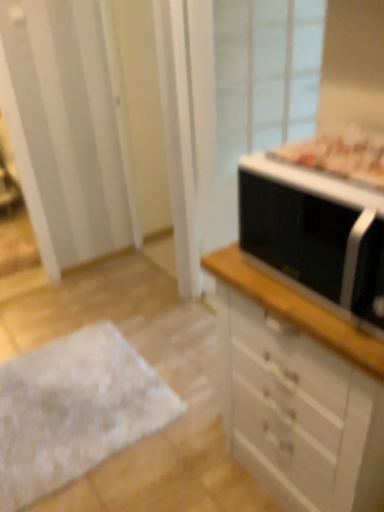
Question: Is white fluffy rug at lower left looking in the opposite direction of transparent glass screen door at upper right?

Choices:
 (A) yes
 (B) no

Answer: (B)

Question: From the image's perspective, would you say white fluffy rug at lower left is shown under transparent glass screen door at upper right?

Choices:
 (A) no
 (B) yes

Answer: (B)

Question: From a real-world perspective, is white fluffy rug at lower left beneath transparent glass screen door at upper right?

Choices:
 (A) no
 (B) yes

Answer: (B)

Question: Is white fluffy rug at lower left closer to the viewer compared to transparent glass screen door at upper right?

Choices:
 (A) no
 (B) yes

Answer: (B)

Question: Can you confirm if white fluffy rug at lower left is positioned to the left of transparent glass screen door at upper right?

Choices:
 (A) yes
 (B) no

Answer: (A)

Question: From the image's perspective, is black matte microwave at right located above or below transparent glass screen door at upper right?

Choices:
 (A) above
 (B) below

Answer: (B)

Question: Considering the positions of black matte microwave at right and transparent glass screen door at upper right in the image, is black matte microwave at right bigger or smaller than transparent glass screen door at upper right?

Choices:
 (A) small
 (B) big

Answer: (A)

Question: In the image, is black matte microwave at right positioned in front of or behind transparent glass screen door at upper right?

Choices:
 (A) front
 (B) behind

Answer: (A)

Question: Do you think black matte microwave at right is within transparent glass screen door at upper right, or outside of it?

Choices:
 (A) outside
 (B) inside

Answer: (A)

Question: Considering their positions, is white fluffy rug at lower left located in front of or behind transparent glass screen door at upper right?

Choices:
 (A) behind
 (B) front

Answer: (B)

Question: Does point (19, 459) appear closer or farther from the camera than point (216, 7)?

Choices:
 (A) farther
 (B) closer

Answer: (B)

Question: In terms of height, does white fluffy rug at lower left look taller or shorter compared to transparent glass screen door at upper right?

Choices:
 (A) tall
 (B) short

Answer: (B)

Question: From the image's perspective, is white fluffy rug at lower left located above or below transparent glass screen door at upper right?

Choices:
 (A) below
 (B) above

Answer: (A)

Question: Considering the positions of white glossy chest of drawers at right and black matte microwave at right in the image, is white glossy chest of drawers at right wider or thinner than black matte microwave at right?

Choices:
 (A) thin
 (B) wide

Answer: (B)

Question: From the image's perspective, relative to black matte microwave at right, is white glossy chest of drawers at right above or below?

Choices:
 (A) below
 (B) above

Answer: (A)